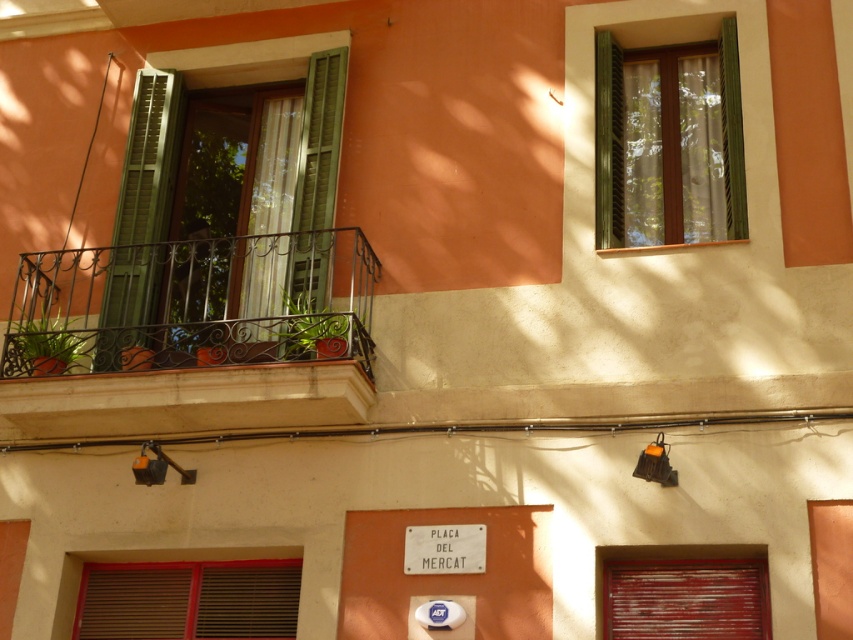
Is brown wooden blinds at lower left to the right of white plastic sign at center from the viewer's perspective?

No, brown wooden blinds at lower left is not to the right of white plastic sign at center.

Does point (149, 577) come closer to viewer compared to point (415, 536)?

No, it is not.

Where is `brown wooden blinds at lower left`? brown wooden blinds at lower left is located at coordinates (189, 600).

Is metallic wrought iron balcony at left to the left of wooden slatted shutter at lower right from the viewer's perspective?

Yes, metallic wrought iron balcony at left is to the left of wooden slatted shutter at lower right.

Between metallic wrought iron balcony at left and wooden slatted shutter at lower right, which one appears on the left side from the viewer's perspective?

metallic wrought iron balcony at left

At what (x,y) coordinates should I click in order to perform the action: click on metallic wrought iron balcony at left. Please return your answer as a coordinate pair (x, y). The height and width of the screenshot is (640, 853). Looking at the image, I should click on (184, 332).

Measure the distance between point (614, 570) and camera.

Point (614, 570) is 24.93 feet away from camera.

Which is behind, point (701, 582) or point (331, 168)?

Positioned behind is point (331, 168).

I want to click on wooden slatted shutter at lower right, so click(x=685, y=600).